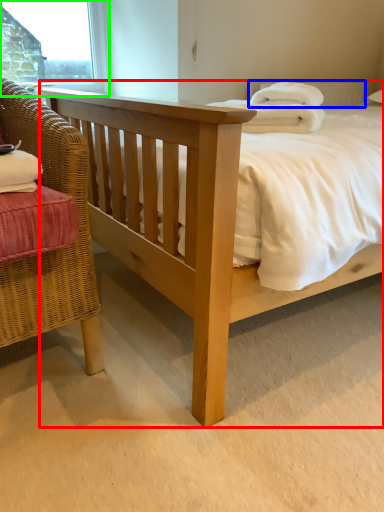
Question: Which object is positioned farthest from bed (highlighted by a red box)? Select from pillow (highlighted by a blue box) and window frame (highlighted by a green box).

Choices:
 (A) pillow
 (B) window frame

Answer: (B)